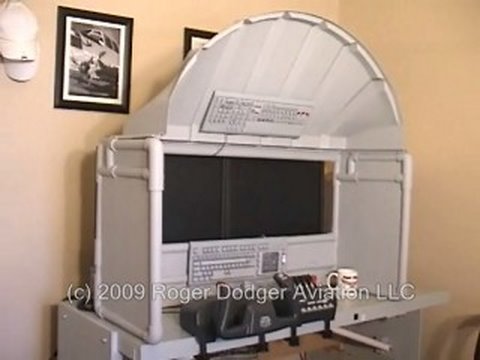
Image resolution: width=480 pixels, height=360 pixels. Find the location of `computer keyboard`. computer keyboard is located at coordinates (215, 101), (309, 110), (302, 130), (208, 123), (191, 246), (192, 277), (272, 269), (280, 243).